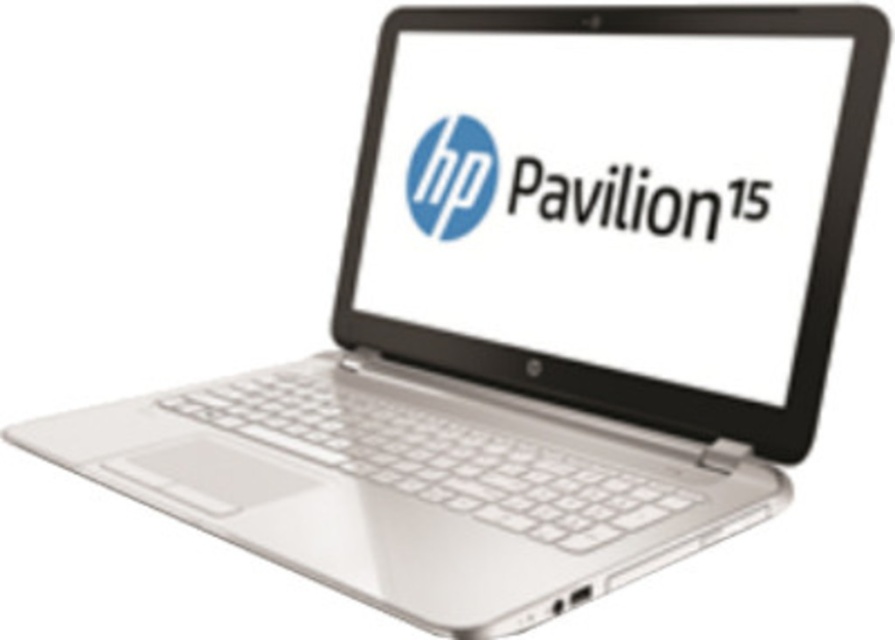
You are a customer looking at the HP Pavilion 15 laptop. You notice the silver glossy laptop screen at center and the matte plastic logo at center. Which object is positioned higher on the laptop?

The matte plastic logo at center is positioned higher than the silver glossy laptop screen at center because the screen is located below the logo.

You are trying to locate the silver glossy laptop screen at center. Can you confirm if this screen is positioned at the point with coordinates (x=612, y=188)?

Yes, the silver glossy laptop screen at center is located exactly at the point with coordinates (x=612, y=188).